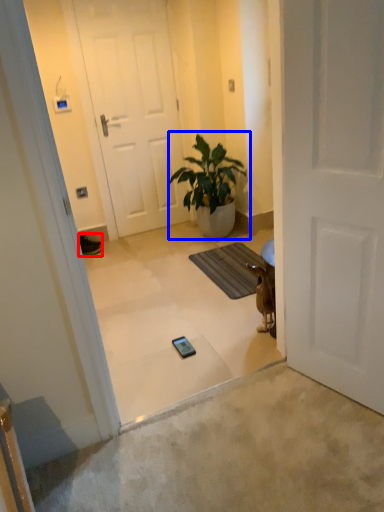
Question: Among these objects, which one is farthest to the camera, sneakers (highlighted by a red box) or houseplant (highlighted by a blue box)?

Choices:
 (A) sneakers
 (B) houseplant

Answer: (A)